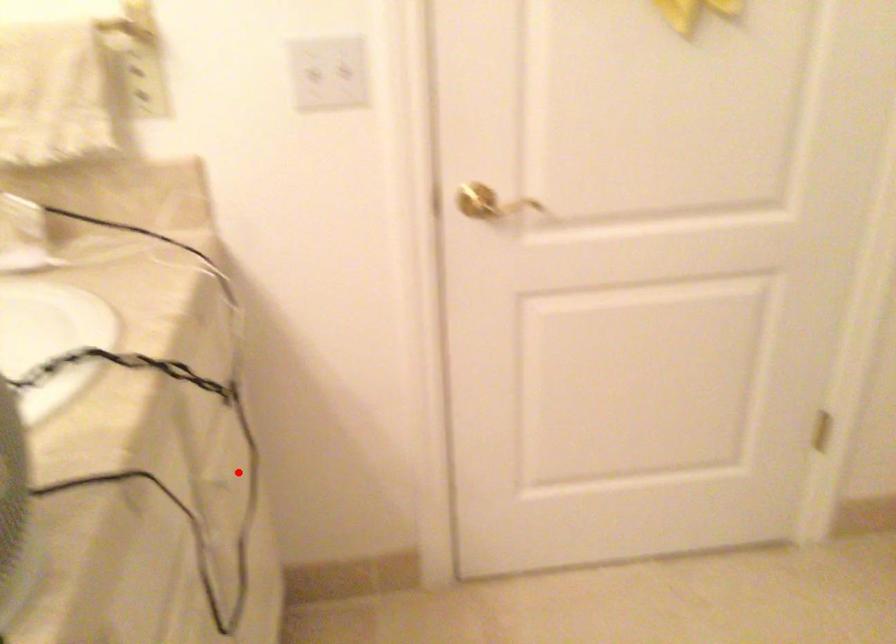
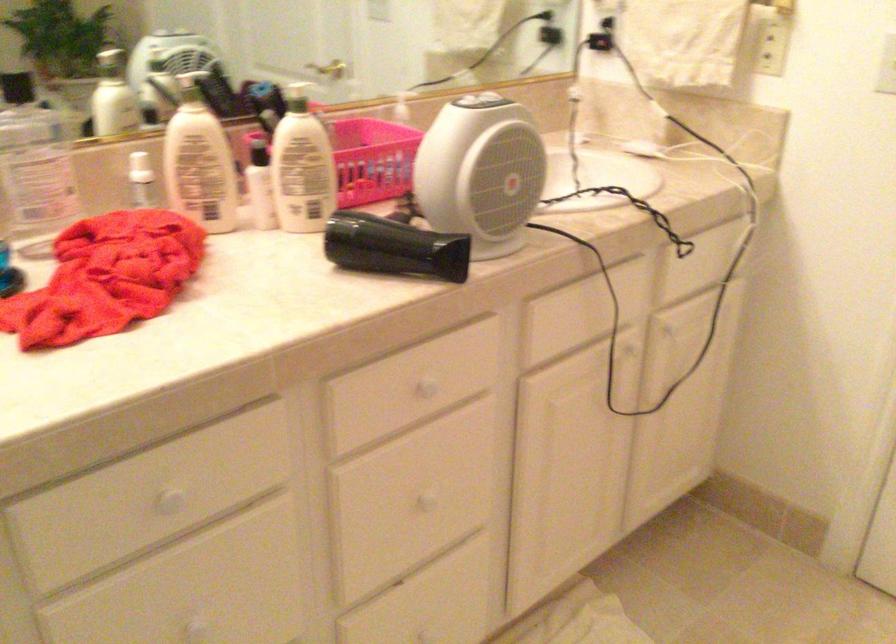
The point at the highlighted location is marked in the first image. Where is the corresponding point in the second image?

(675, 335)